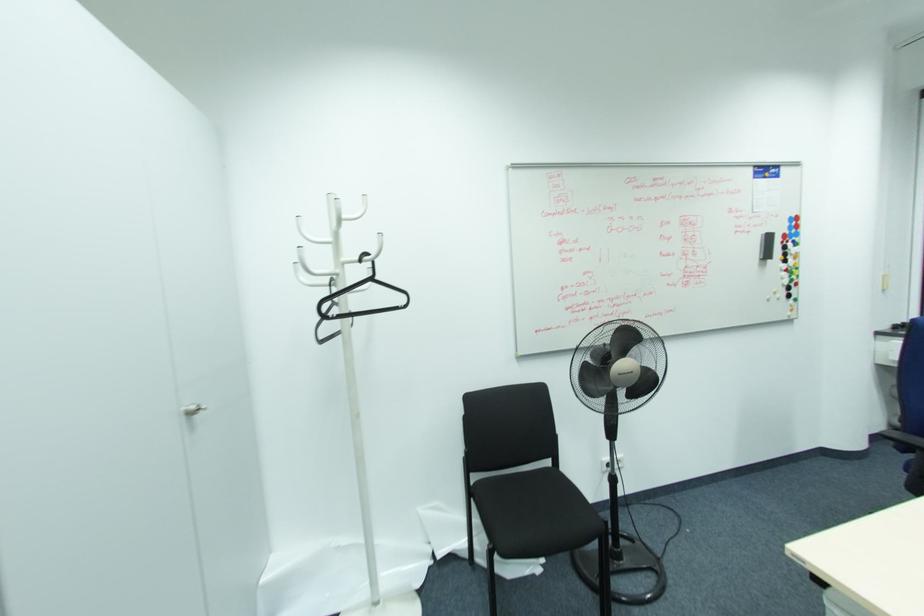
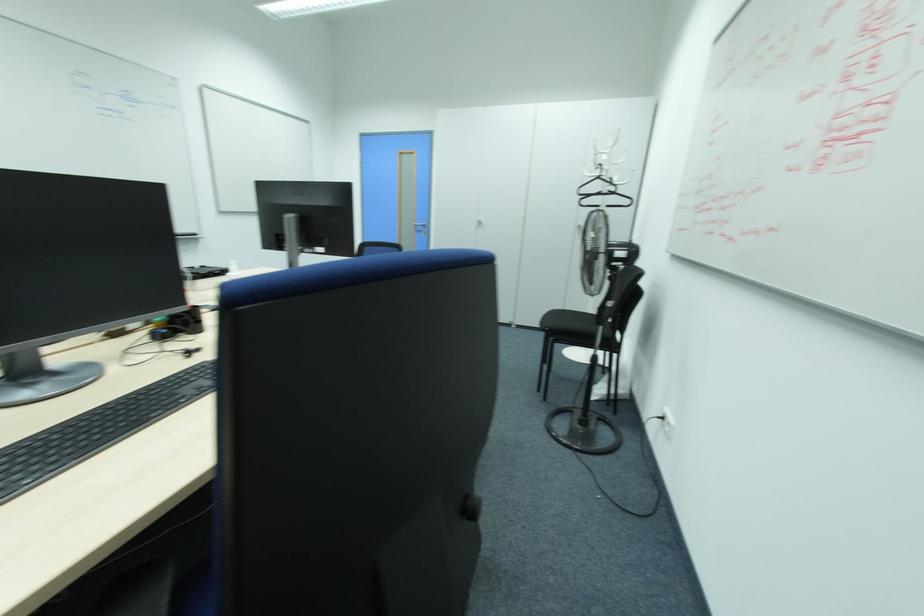
Where in the second image is the point corresponding to the point at 371,280 from the first image?

(599, 177)